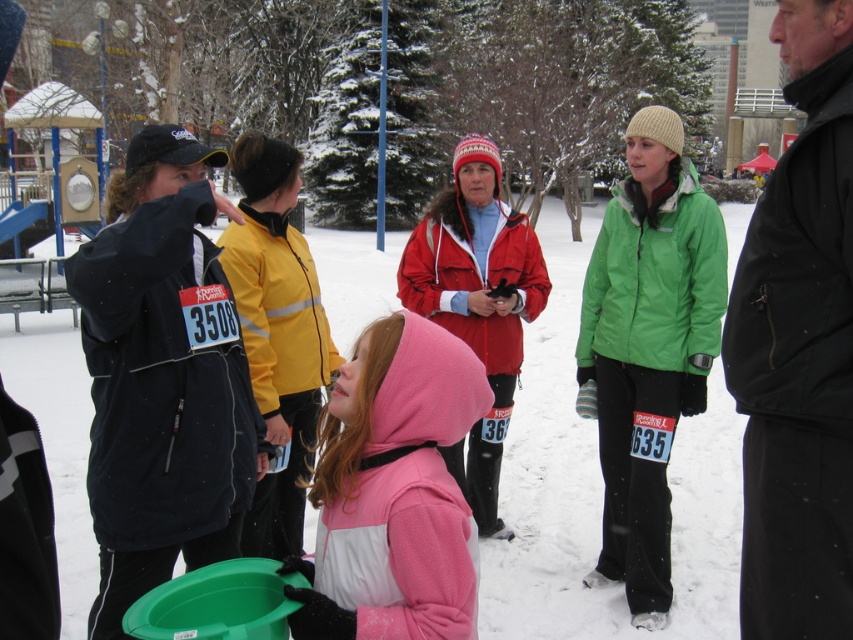
You are a photographer standing in the snowy park scene. You want to take a photo that includes both the point at coordinates point [817,548] and point [631,381]. Since you want the point closer to the camera to be in focus, which point should you focus on?

Point point [817,548] is closer to the camera than point point [631,381], so you should focus on point point [817,548] to ensure it is in focus.

You are standing in the snowy park and want to locate the black matte jacket at center. What are the coordinates where you should look?

The black matte jacket at center is located at coordinates point (799, 348).

You are organizing a winter race and need to ensure participants have enough space to move between the green matte jacket at center and the pink fleece jacket at center. What is the minimum width required for a pathway between them to allow a 1.8 meter long sled to pass through?

The pathway between the green matte jacket at center and the pink fleece jacket at center is 2.35 meters wide. Since the sled is 1.8 meters long, the pathway is wide enough to accommodate the sled passing through.